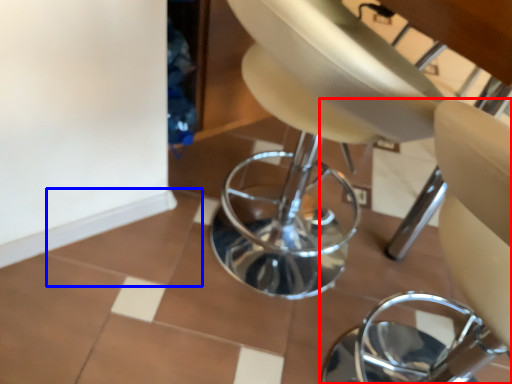
Question: Which point is closer to the camera, chair (highlighted by a red box) or ceramic tile (highlighted by a blue box)?

Choices:
 (A) chair
 (B) ceramic tile

Answer: (A)